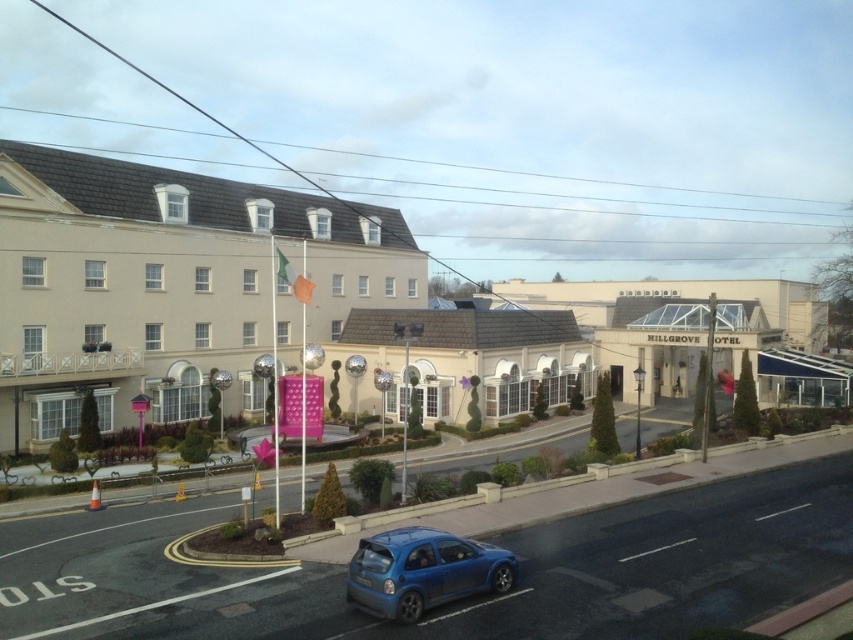
Question: Is beige stone building at upper left to the left of metallic blue hatchback at lower center from the viewer's perspective?

Choices:
 (A) yes
 (B) no

Answer: (A)

Question: Is beige stone building at upper left wider than metallic blue hatchback at lower center?

Choices:
 (A) yes
 (B) no

Answer: (A)

Question: Which of the following is the closest to the observer?

Choices:
 (A) (399, 552)
 (B) (379, 248)

Answer: (A)

Question: Which object is farther from the camera taking this photo?

Choices:
 (A) metallic blue hatchback at lower center
 (B) beige stone building at upper left

Answer: (B)

Question: Can you confirm if beige stone building at upper left is smaller than metallic blue hatchback at lower center?

Choices:
 (A) no
 (B) yes

Answer: (A)